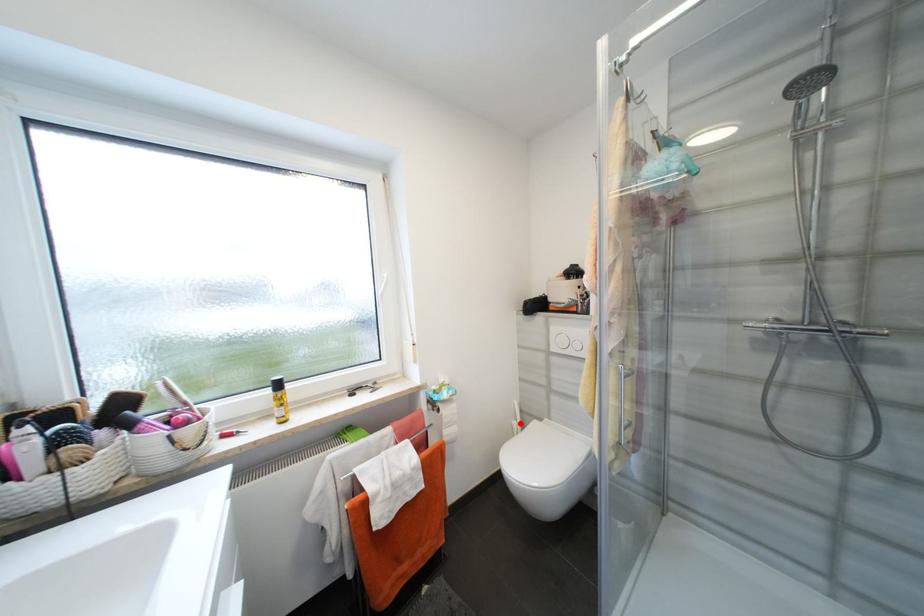
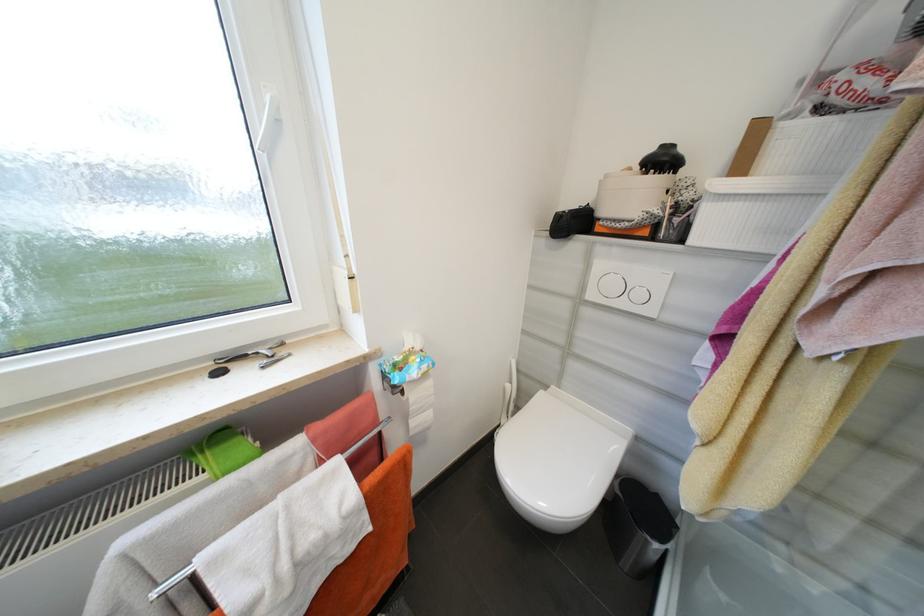
Find the pixel in the second image that matches the highlighted location in the first image.

(514, 387)